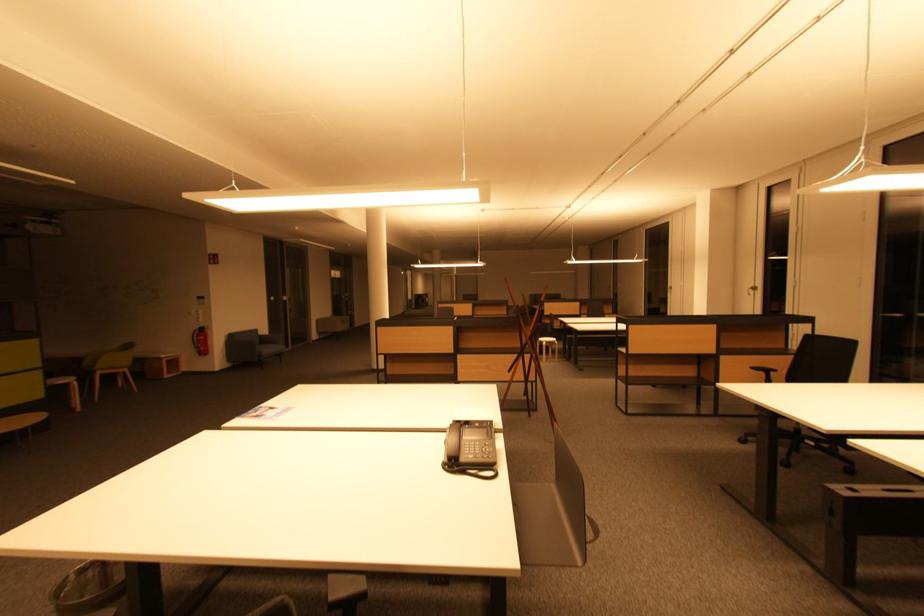
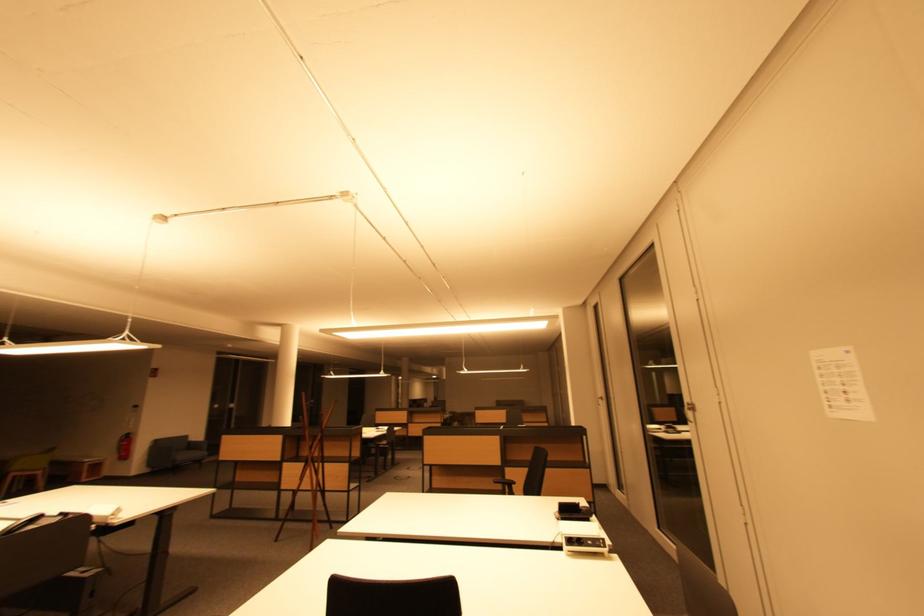
The point at (759, 291) is marked in the first image. Where is the corresponding point in the second image?

(605, 400)